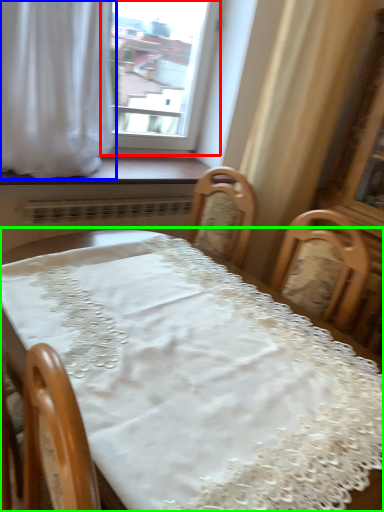
Question: Considering the real-world distances, which object is closest to window (highlighted by a red box)? curtain (highlighted by a blue box) or table (highlighted by a green box).

Choices:
 (A) curtain
 (B) table

Answer: (A)